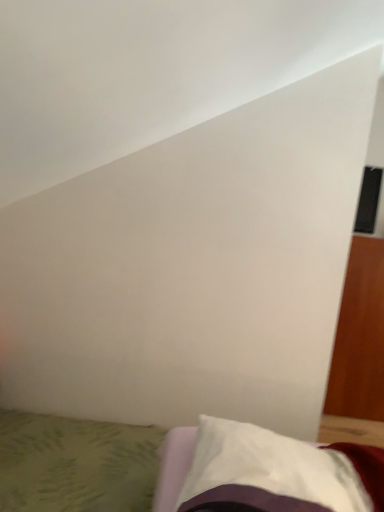
I want to click on free space above white soft pillow at lower right (from a real-world perspective), so click(x=280, y=464).